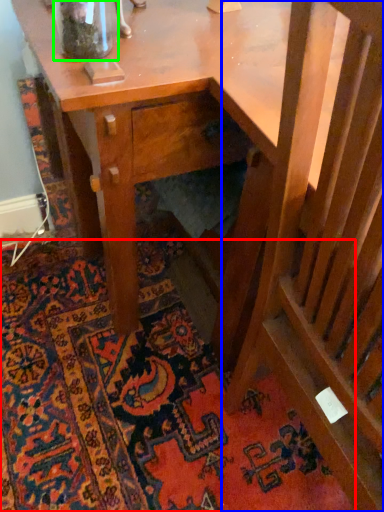
Question: Based on their relative distances, which object is nearer to mat (highlighted by a red box)? Choose from rocking chair (highlighted by a blue box) and glass vase (highlighted by a green box).

Choices:
 (A) rocking chair
 (B) glass vase

Answer: (A)